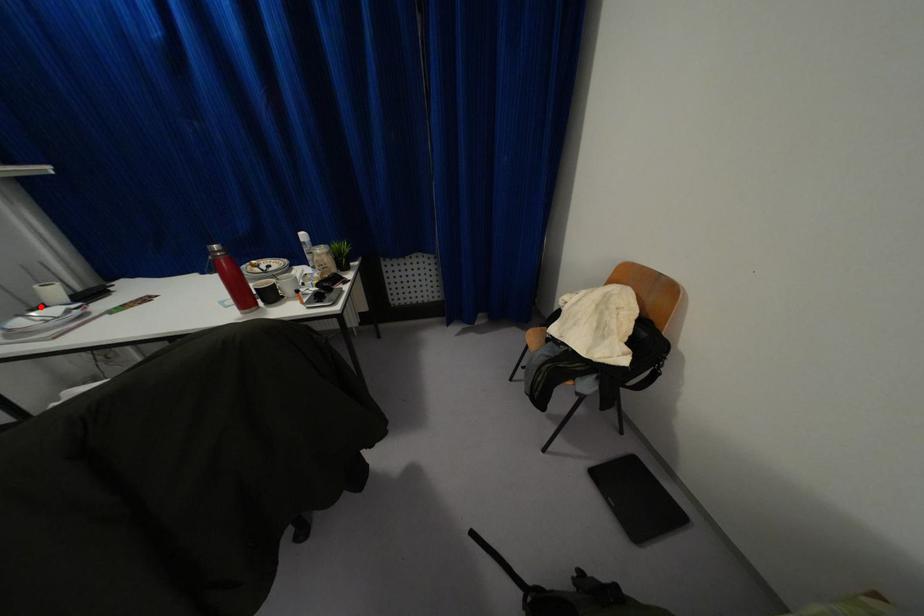
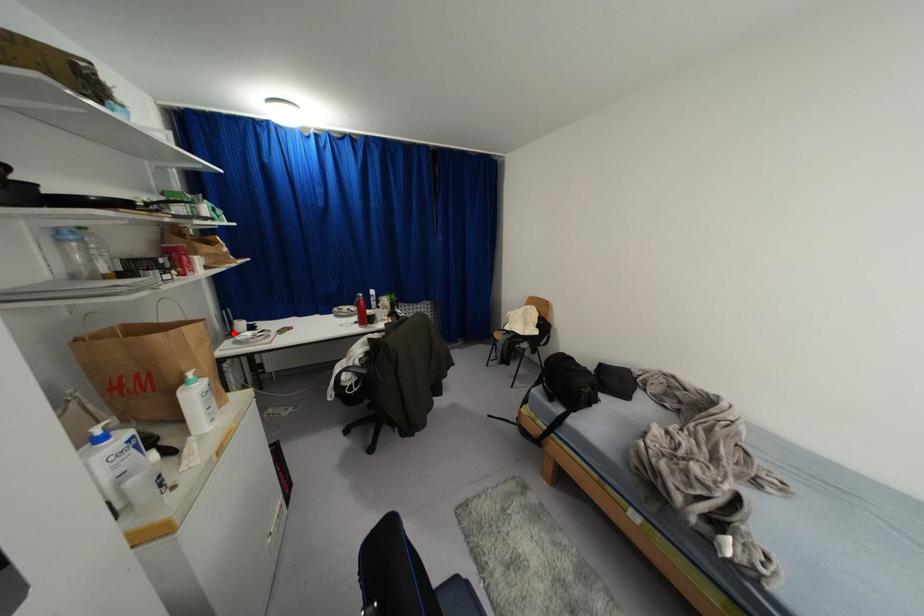
I am providing you with two images of the same scene from different viewpoints. A red point is marked on the first image and another point is marked on the second image. Is the red point in image1 aligned with the point shown in image2?

Yes